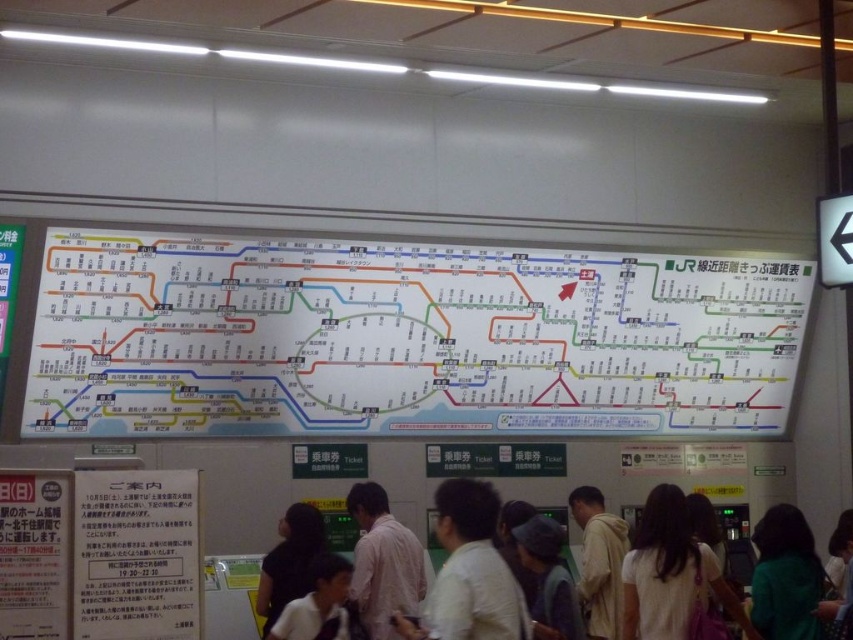
You are a traveler looking at the train map in the station. You notice two people wearing a white shirt at center and a light beige hoodie at center. Which clothing item is positioned lower on the person?

The white shirt at center is located below the light beige hoodie at center, so the white shirt at center is positioned lower on the person.

You are a traveler standing in the train station and need to check the white paper map at center and the light beige hoodie at center. Which object is located higher up in the image?

The white paper map at center is above the light beige hoodie at center, so it is located higher up in the image.